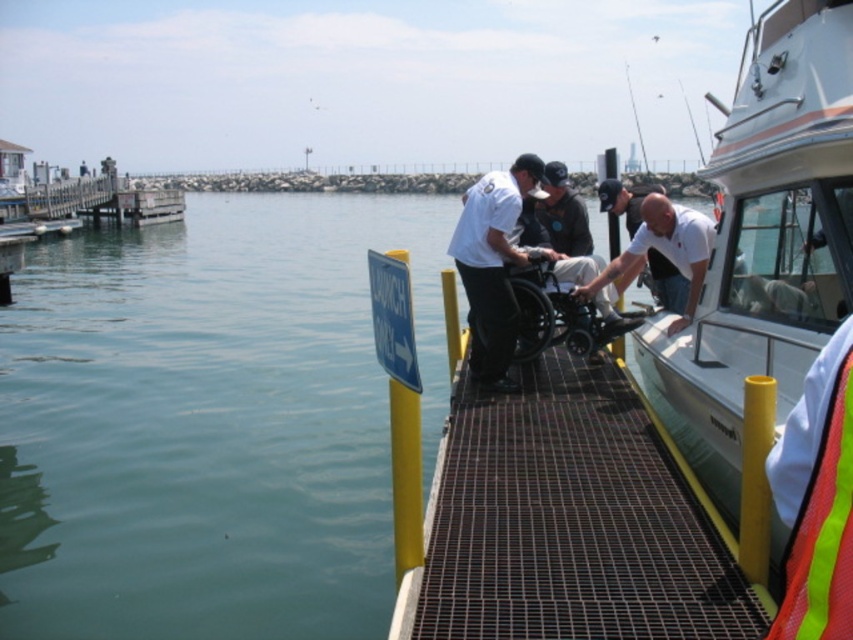
Question: Based on their relative distances, which object is farther from the white uniform at center?

Choices:
 (A) white matte shirt at center
 (B) green water at lower left
 (C) white glossy boat at right

Answer: (B)

Question: From the image, what is the correct spatial relationship of green water at lower left in relation to white matte shirt at center?

Choices:
 (A) right
 (B) left

Answer: (B)

Question: Which object appears closest to the camera in this image?

Choices:
 (A) white matte shirt at center
 (B) metallic gray dock at center

Answer: (B)

Question: Does white glossy boat at right appear on the right side of white matte shirt at center?

Choices:
 (A) no
 (B) yes

Answer: (B)

Question: Is metallic gray dock at center to the left of black plastic wheelchair at center from the viewer's perspective?

Choices:
 (A) no
 (B) yes

Answer: (B)

Question: Which of the following is the farthest from the observer?

Choices:
 (A) (831, 396)
 (B) (756, 260)
 (C) (599, 278)
 (D) (482, 300)

Answer: (C)